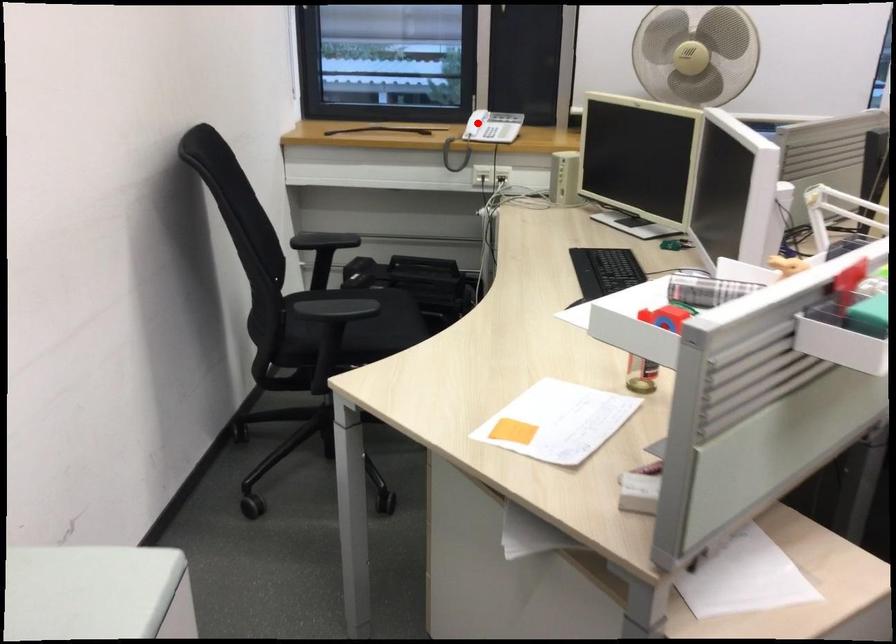
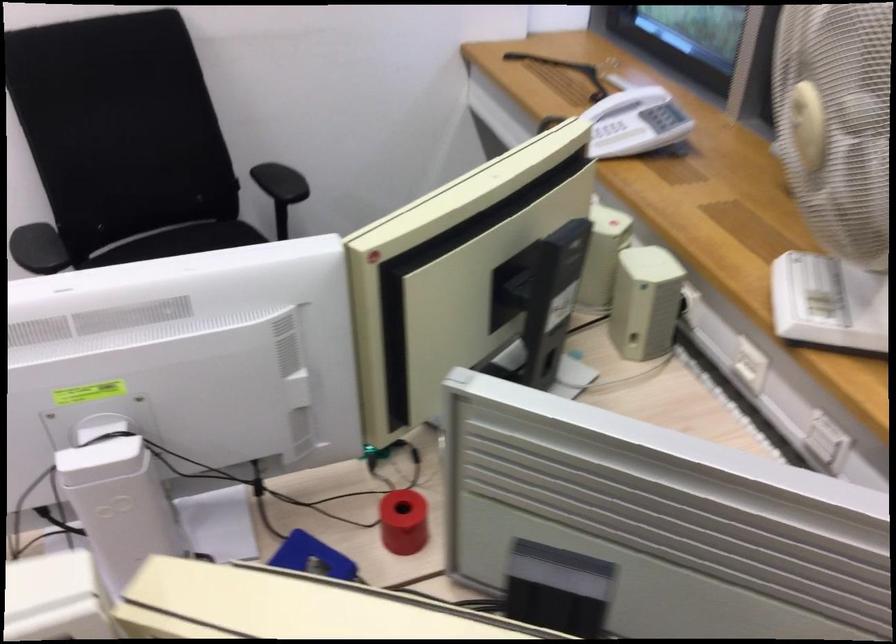
Question: I am providing you with two images of the same scene from different viewpoints. In image1, a red point is highlighted. Considering the same 3D point in image2, which of the following is correct?

Choices:
 (A) It is closer
 (B) It is farther

Answer: (A)